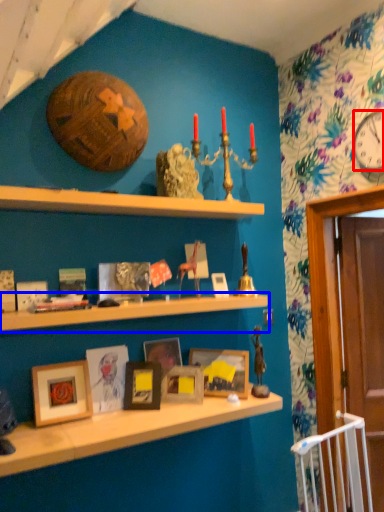
Question: Which point is closer to the camera, clock (highlighted by a red box) or shelf (highlighted by a blue box)?

Choices:
 (A) clock
 (B) shelf

Answer: (B)